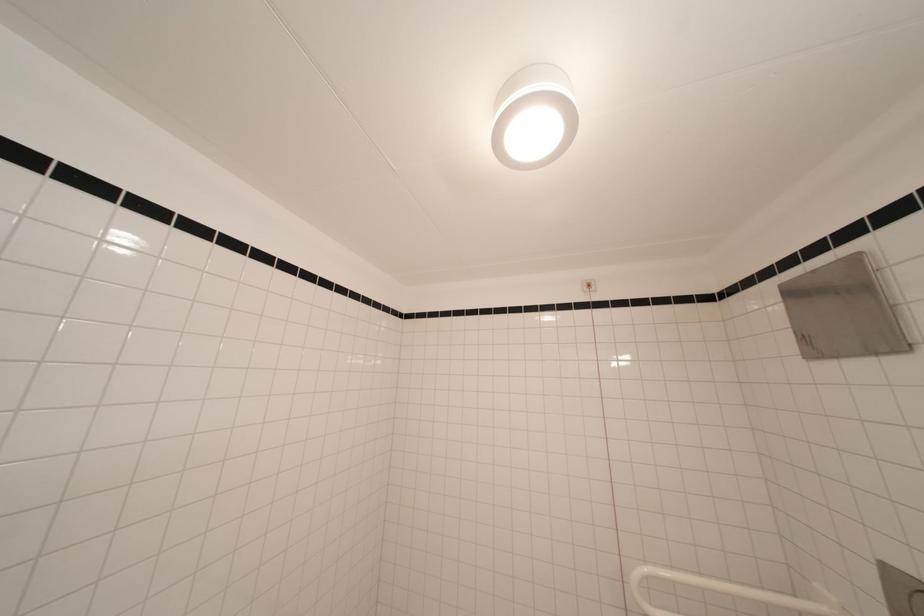
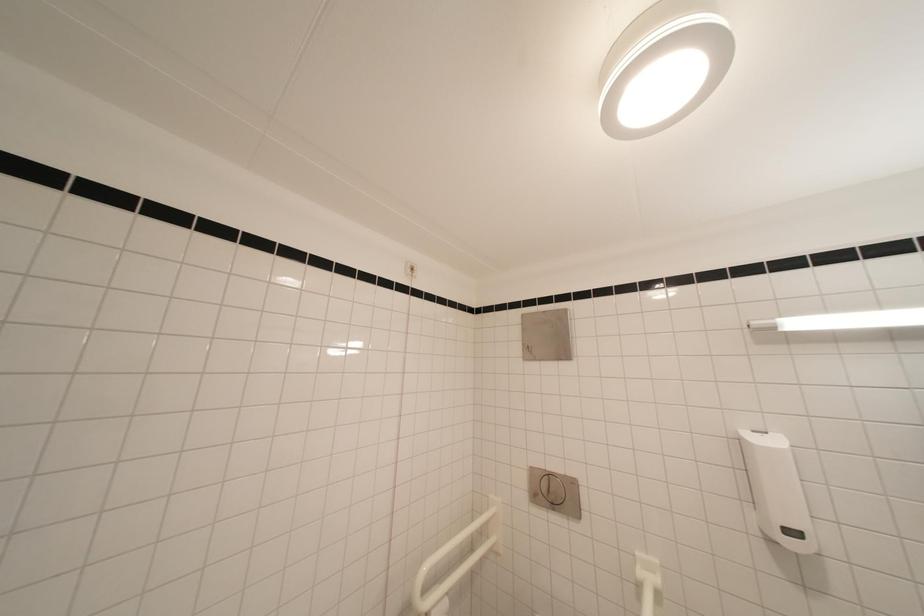
Question: The camera is either moving clockwise (left) or counter-clockwise (right) around the object. The first image is from the beginning of the video and the second image is from the end. Is the camera moving left or right when shooting the video?

Choices:
 (A) Left
 (B) Right

Answer: (A)